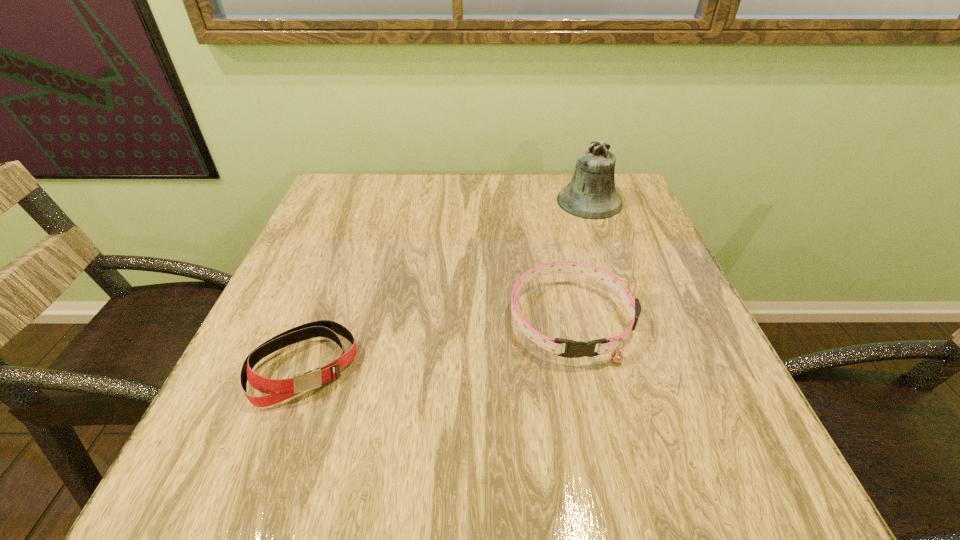
The height and width of the screenshot is (540, 960). What are the coordinates of `vacant space that satisfies the following two spatial constraints: 1. on the back side of the bell; 2. on the right side of the leftmost object` in the screenshot? It's located at (365, 201).